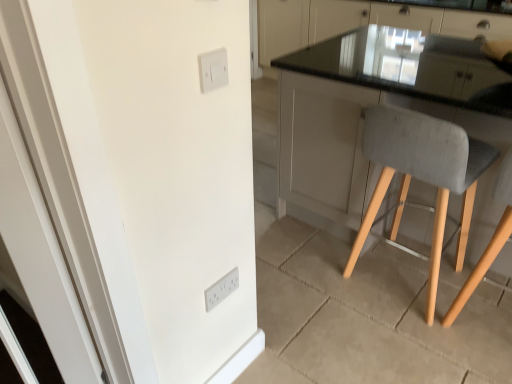
The image size is (512, 384). What do you see at coordinates (221, 289) in the screenshot?
I see `white plastic light switch at lower center, which is the second light switch from top to bottom` at bounding box center [221, 289].

I want to click on white plastic light switch at lower center, acting as the first light switch starting from the back, so click(221, 289).

Would you say white glossy door at left is a long distance from white plastic light switch at upper center, the first light switch viewed from the front?

Actually, white glossy door at left and white plastic light switch at upper center, the first light switch viewed from the front, are a little close together.

From the picture: From the image's perspective, is white glossy door at left located above or below white plastic light switch at upper center, the 2th light switch in the bottom-to-top sequence?

white glossy door at left is situated lower than white plastic light switch at upper center, the 2th light switch in the bottom-to-top sequence, in the image.

Can you confirm if white glossy door at left is positioned to the left of white plastic light switch at upper center, placed as the 2th light switch when sorted from back to front?

Yes.

How many degrees apart are the facing directions of white glossy door at left and white plastic light switch at upper center, placed as the 2th light switch when sorted from back to front?

They differ by 53.6 degrees in their facing directions.

Would you say white plastic light switch at upper center, the 1th light switch in the top-to-bottom sequence, is to the left or to the right of white plastic light switch at lower center, which is the second light switch from top to bottom, in the picture?

From the image, it's evident that white plastic light switch at upper center, the 1th light switch in the top-to-bottom sequence, is to the right of white plastic light switch at lower center, which is the second light switch from top to bottom.

Between point (200, 62) and point (232, 286), which one is positioned in front?

The point (200, 62) is closer to the camera.

In terms of height, does white plastic light switch at upper center, the 1th light switch in the top-to-bottom sequence, look taller or shorter compared to white plastic light switch at lower center, which is the second light switch from top to bottom?

Considering their sizes, white plastic light switch at upper center, the 1th light switch in the top-to-bottom sequence, has less height than white plastic light switch at lower center, which is the second light switch from top to bottom.

Does black glass countertop at upper right touch white glossy door at left?

black glass countertop at upper right and white glossy door at left are not in contact.

Based on the photo, which is more to the left, black glass countertop at upper right or white glossy door at left?

white glossy door at left is more to the left.

From the image's perspective, which one is positioned lower, black glass countertop at upper right or white glossy door at left?

white glossy door at left, from the image's perspective.

From a real-world perspective, is black glass countertop at upper right beneath white glossy door at left?

Indeed, from a real-world perspective, black glass countertop at upper right is positioned beneath white glossy door at left.

Can you confirm if white glossy door at left is positioned to the right of white plastic light switch at lower center, acting as the first light switch starting from the back?

No.

Looking at this image, can you confirm if white glossy door at left is shorter than white plastic light switch at lower center, acting as the first light switch starting from the back?

Incorrect, the height of white glossy door at left does not fall short of that of white plastic light switch at lower center, acting as the first light switch starting from the back.

Is point (56, 19) less distant than point (231, 281)?

Yes, it is in front of point (231, 281).

Consider the image. How different are the orientations of white glossy door at left and white plastic light switch at lower center, acting as the first light switch starting from the back, in degrees?

The facing directions of white glossy door at left and white plastic light switch at lower center, acting as the first light switch starting from the back, are 53.6 degrees apart.

Between white plastic light switch at lower center, the second light switch from the front, and white plastic light switch at upper center, the first light switch viewed from the front, which one has larger size?

white plastic light switch at lower center, the second light switch from the front.

From the image's perspective, which is below, white plastic light switch at lower center, which is the second light switch from top to bottom, or white plastic light switch at upper center, the 1th light switch in the top-to-bottom sequence?

white plastic light switch at lower center, which is the second light switch from top to bottom, from the image's perspective.

Would you say white plastic light switch at upper center, the 2th light switch in the bottom-to-top sequence, is part of white plastic light switch at lower center, which is the second light switch from top to bottom,'s contents?

No, white plastic light switch at upper center, the 2th light switch in the bottom-to-top sequence, is not inside white plastic light switch at lower center, which is the second light switch from top to bottom.

Can you see white plastic light switch at lower center, which is the second light switch from top to bottom, touching white plastic light switch at upper center, the 1th light switch in the top-to-bottom sequence?

No, white plastic light switch at lower center, which is the second light switch from top to bottom, is not with white plastic light switch at upper center, the 1th light switch in the top-to-bottom sequence.

Is white plastic light switch at upper center, the 2th light switch in the bottom-to-top sequence, at the right side of gray fabric chair at right?

No, white plastic light switch at upper center, the 2th light switch in the bottom-to-top sequence, is not to the right of gray fabric chair at right.

From a real-world perspective, is white plastic light switch at upper center, the first light switch viewed from the front, positioned under gray fabric chair at right based on gravity?

No, from a real-world perspective, white plastic light switch at upper center, the first light switch viewed from the front, is not under gray fabric chair at right.

Is gray fabric chair at right inside the boundaries of white plastic light switch at upper center, placed as the 2th light switch when sorted from back to front, or outside?

The correct answer is: outside.

Is gray fabric chair at right bigger than white plastic light switch at upper center, the 2th light switch in the bottom-to-top sequence?

Correct, gray fabric chair at right is larger in size than white plastic light switch at upper center, the 2th light switch in the bottom-to-top sequence.

The height and width of the screenshot is (384, 512). I want to click on light switch that is the 2nd object above the gray fabric chair at right (from a real-world perspective), so click(213, 70).

From the image's perspective, is gray fabric chair at right below white plastic light switch at upper center, the first light switch viewed from the front?

Yes, from the image's perspective, gray fabric chair at right is below white plastic light switch at upper center, the first light switch viewed from the front.

Where is `the 1st light switch behind the white glossy door at left`? the 1st light switch behind the white glossy door at left is located at coordinates (213, 70).

This screenshot has height=384, width=512. I want to click on light switch below the white plastic light switch at upper center, the 1th light switch in the top-to-bottom sequence (from a real-world perspective), so click(221, 289).

Which object lies nearer to the anchor point black glass countertop at upper right, gray fabric chair at right or white plastic light switch at upper center, the 1th light switch in the top-to-bottom sequence?

Based on the image, gray fabric chair at right appears to be nearer to black glass countertop at upper right.

Consider the image. Looking at the image, which one is located further to white plastic light switch at upper center, placed as the 2th light switch when sorted from back to front, white plastic light switch at lower center, the second light switch from the front, or white glossy door at left?

Among the two, white plastic light switch at lower center, the second light switch from the front, is located further to white plastic light switch at upper center, placed as the 2th light switch when sorted from back to front.

Looking at the image, which one is located closer to black glass countertop at upper right, white plastic light switch at upper center, the 1th light switch in the top-to-bottom sequence, or white plastic light switch at lower center, acting as the first light switch starting from the back?

white plastic light switch at lower center, acting as the first light switch starting from the back.

Considering their positions, is white glossy door at left positioned further to white plastic light switch at lower center, acting as the first light switch starting from the back, than gray fabric chair at right?

gray fabric chair at right lies further to white plastic light switch at lower center, acting as the first light switch starting from the back, than the other object.

Considering their positions, is gray fabric chair at right positioned further to white plastic light switch at upper center, placed as the 2th light switch when sorted from back to front, than white glossy door at left?

gray fabric chair at right is further to white plastic light switch at upper center, placed as the 2th light switch when sorted from back to front.

Looking at the image, which one is located further to white plastic light switch at lower center, which is counted as the 1th light switch, starting from the bottom, white plastic light switch at upper center, placed as the 2th light switch when sorted from back to front, or gray fabric chair at right?

gray fabric chair at right.

Considering their positions, is gray fabric chair at right positioned closer to white glossy door at left than white plastic light switch at lower center, which is the second light switch from top to bottom?

white plastic light switch at lower center, which is the second light switch from top to bottom, is closer to white glossy door at left.

Which object lies further to the anchor point gray fabric chair at right, black glass countertop at upper right or white glossy door at left?

black glass countertop at upper right lies further to gray fabric chair at right than the other object.

You are a GUI agent. You are given a task and a screenshot of the screen. Output one action in this format:
    pyautogui.click(x=<x>, y=<y>)
    Task: Click on the light switch located between white plastic light switch at lower center, the second light switch from the front, and gray fabric chair at right in the left-right direction
    This screenshot has width=512, height=384.
    Given the screenshot: What is the action you would take?
    pyautogui.click(x=213, y=70)

Where is `chair between black glass countertop at upper right and white plastic light switch at lower center, the second light switch from the front, vertically`? chair between black glass countertop at upper right and white plastic light switch at lower center, the second light switch from the front, vertically is located at coordinates (423, 174).

I want to click on light switch positioned between white plastic light switch at upper center, placed as the 2th light switch when sorted from back to front, and black glass countertop at upper right from near to far, so click(x=221, y=289).

Locate an element on the screen. The width and height of the screenshot is (512, 384). screen door between white plastic light switch at upper center, the first light switch viewed from the front, and white plastic light switch at lower center, acting as the first light switch starting from the back, in the vertical direction is located at coordinates (57, 169).